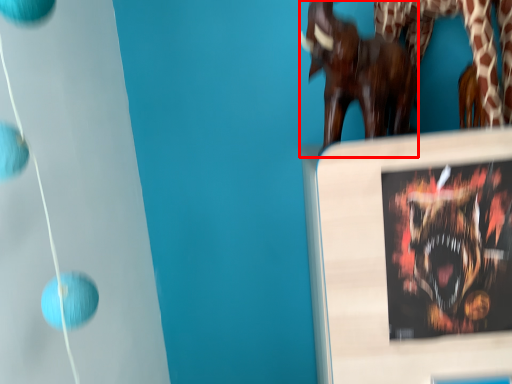
Question: From the image's perspective, where is sculpture (annotated by the red box) located relative to animal?

Choices:
 (A) below
 (B) above

Answer: (B)